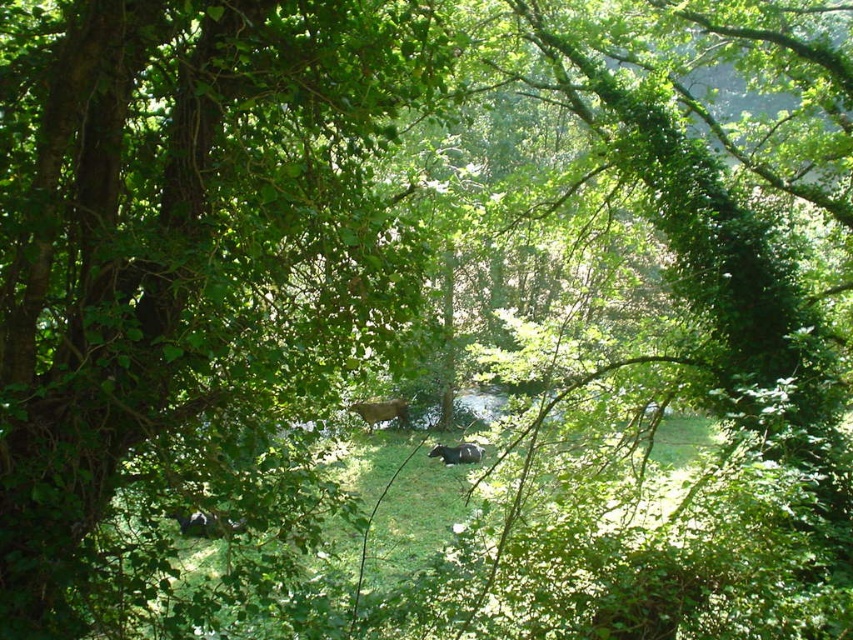
Question: Which of the following is the farthest from the observer?

Choices:
 (A) (473, 449)
 (B) (378, 417)
 (C) (56, 67)

Answer: (B)

Question: Is brown fur cow at center wider than shiny black bear at center?

Choices:
 (A) no
 (B) yes

Answer: (A)

Question: Considering the real-world distances, which object is closest to the brown fur cow at center?

Choices:
 (A) shiny black bear at center
 (B) green leafy tree at center

Answer: (A)

Question: Does brown fur cow at center have a lesser width compared to shiny black bear at center?

Choices:
 (A) no
 (B) yes

Answer: (B)

Question: Among these objects, which one is nearest to the camera?

Choices:
 (A) shiny black bear at center
 (B) brown fur cow at center
 (C) green leafy tree at center

Answer: (C)

Question: Does brown fur cow at center appear on the left side of shiny black bear at center?

Choices:
 (A) no
 (B) yes

Answer: (B)